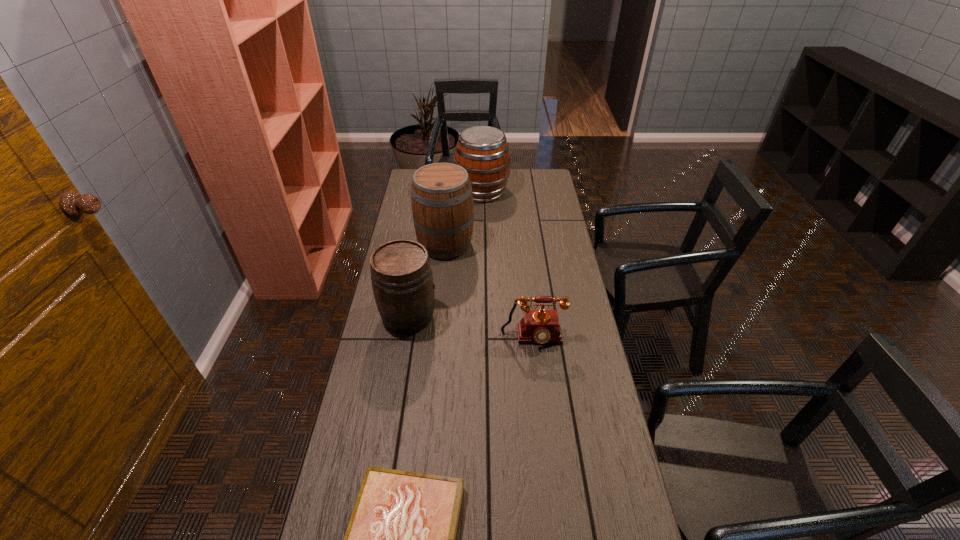
Locate an element on the screen. The height and width of the screenshot is (540, 960). blank space at the far edge is located at coordinates (x=516, y=177).

Where is `blank space at the left edge of the desktop`? blank space at the left edge of the desktop is located at coordinates (404, 384).

This screenshot has width=960, height=540. In the image, there is a desktop. In order to click on vacant space at the right edge in this screenshot , I will do `click(612, 494)`.

This screenshot has height=540, width=960. Find the location of `free space between the farthest cider and the second shortest object`. free space between the farthest cider and the second shortest object is located at coordinates (508, 265).

Image resolution: width=960 pixels, height=540 pixels. Identify the location of empty space between the fourth tallest object and the second farthest object. (489, 292).

Locate an element on the screen. Image resolution: width=960 pixels, height=540 pixels. vacant point located between the fourth tallest object and the second nearest cider is located at coordinates (489, 292).

I want to click on object that stands as the fourth closest to the telephone, so click(x=482, y=151).

Select which object appears as the closest to the nearest object. Please provide its 2D coordinates. Your answer should be formatted as a tuple, i.e. [(x, y)], where the tuple contains the x and y coordinates of a point satisfying the conditions above.

[(542, 326)]

Where is `the second closest cider to the farthest object`? the second closest cider to the farthest object is located at coordinates (402, 281).

This screenshot has width=960, height=540. I want to click on cider that stands as the second closest to the nearest cider, so click(x=482, y=151).